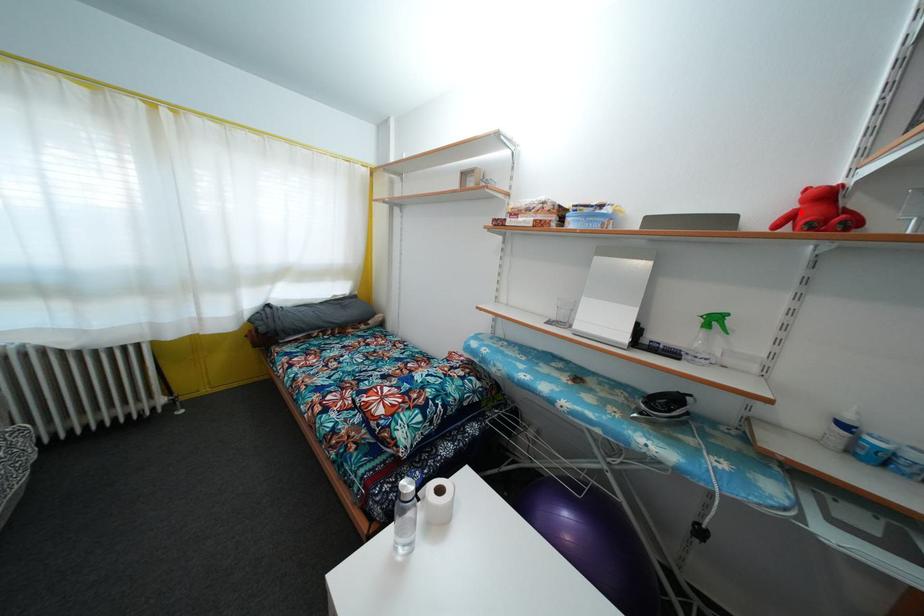
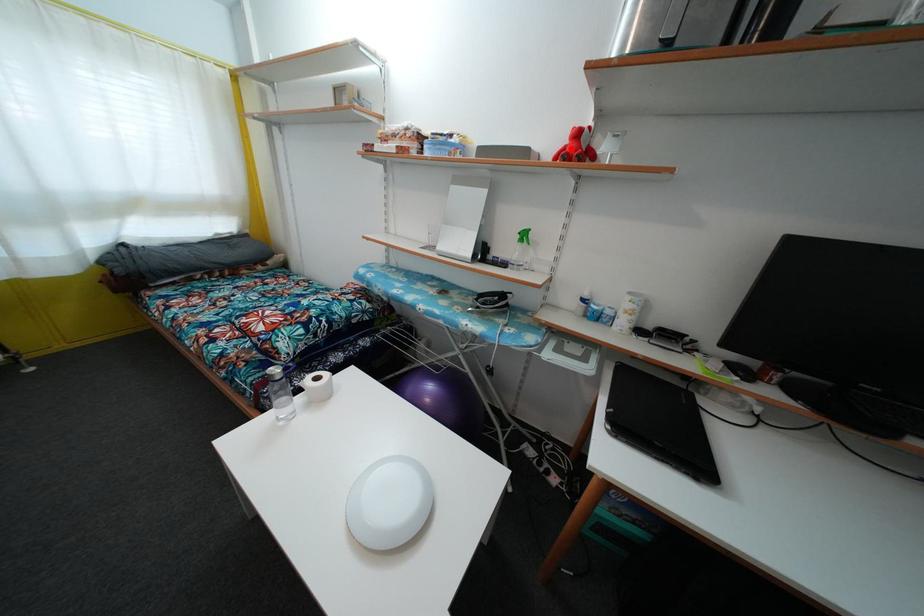
I am providing you with two images of the same scene from different viewpoints. A red point is marked on the first image and another point is marked on the second image. Does the point marked in image1 correspond to the same location as the one in image2?

Yes